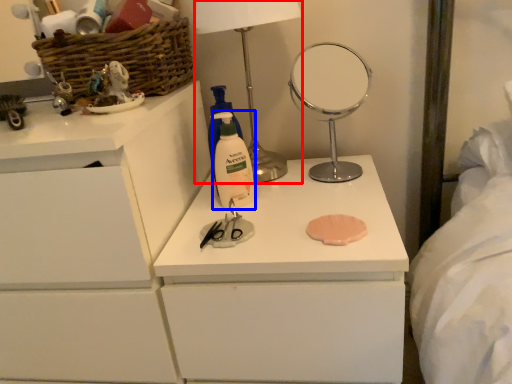
Question: Which object is closer to the camera taking this photo, table lamp (highlighted by a red box) or cleaning product (highlighted by a blue box)?

Choices:
 (A) table lamp
 (B) cleaning product

Answer: (A)